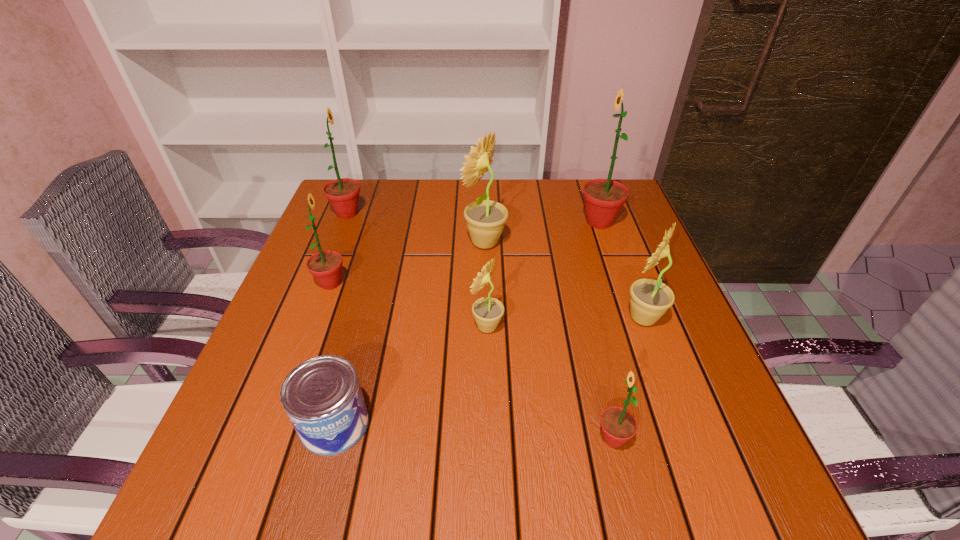
Image resolution: width=960 pixels, height=540 pixels. Find the location of `vacant region located on the face of the second smallest yellow sunflower`. vacant region located on the face of the second smallest yellow sunflower is located at coordinates (574, 318).

The height and width of the screenshot is (540, 960). In order to click on free space located 0.090m on the face of the second smallest yellow sunflower in this screenshot , I will do `click(579, 318)`.

Locate an element on the screen. The width and height of the screenshot is (960, 540). free point located on the face of the fourth nearest sunflower is located at coordinates (x=408, y=284).

The image size is (960, 540). Identify the location of free space located 0.310m on the face of the smallest yellow sunflower. (323, 327).

In order to click on blank area located 0.210m on the face of the smallest yellow sunflower in this screenshot , I will do `click(371, 327)`.

Identify the location of blank space located on the face of the smallest yellow sunflower. This screenshot has width=960, height=540. (337, 327).

You are a GUI agent. You are given a task and a screenshot of the screen. Output one action in this format:
    pyautogui.click(x=<x>, y=<y>)
    Task: Click on the vacant space located 0.320m on the face of the nearest green sunflower
    The height and width of the screenshot is (540, 960).
    Given the screenshot: What is the action you would take?
    pyautogui.click(x=405, y=438)

Find the location of `free space located on the face of the nearest green sunflower`. free space located on the face of the nearest green sunflower is located at coordinates (489, 438).

Find the location of a particular element. The width and height of the screenshot is (960, 540). free point located 0.170m on the face of the nearest green sunflower is located at coordinates (494, 438).

You are a GUI agent. You are given a task and a screenshot of the screen. Output one action in this format:
    pyautogui.click(x=<x>, y=<y>)
    Task: Click on the free region located on the front label of the blue can
    
    Given the screenshot: What is the action you would take?
    pyautogui.click(x=316, y=495)